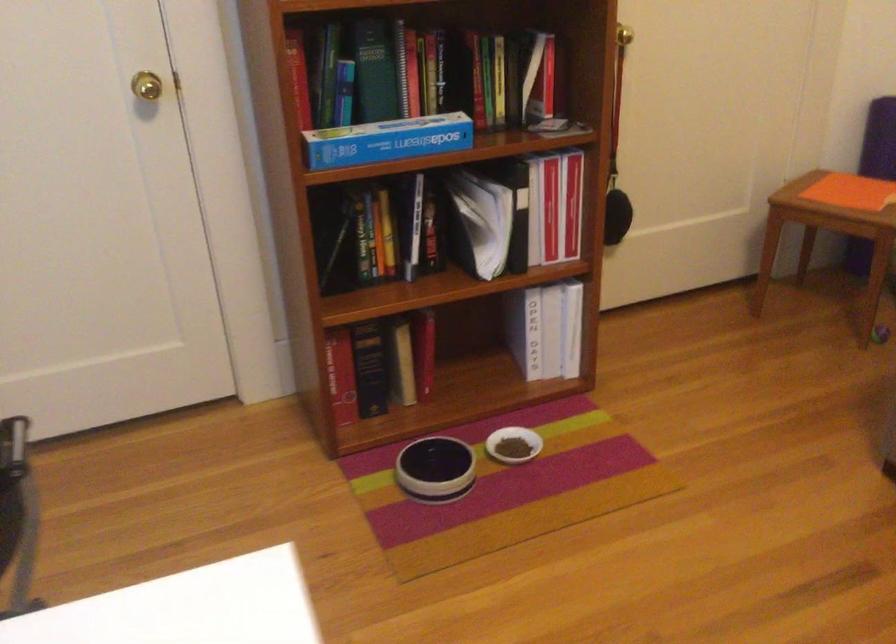
Image resolution: width=896 pixels, height=644 pixels. I want to click on blue sodastream box, so click(386, 140).